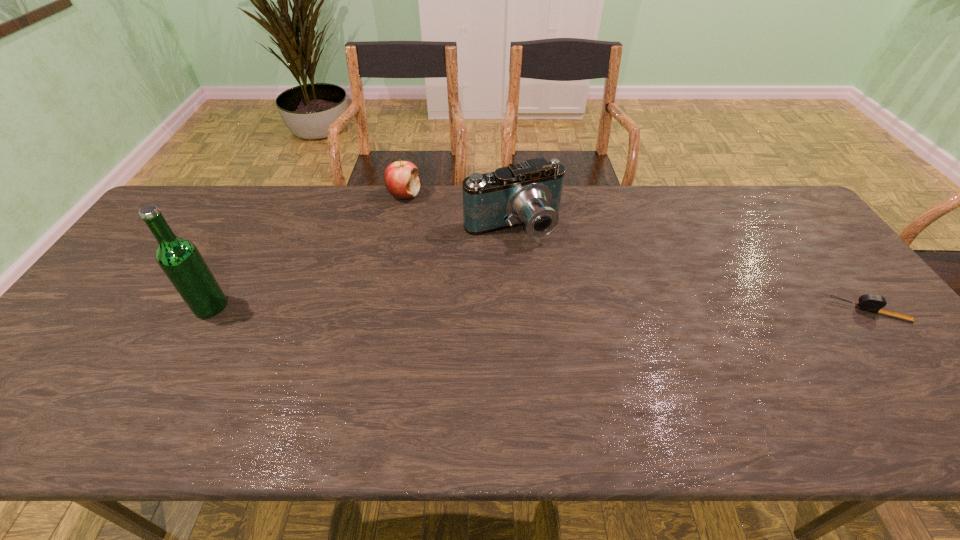
The width and height of the screenshot is (960, 540). Identify the location of empty space between the tallest object and the apple. (307, 251).

Where is `free point between the second tallest object and the leftmost object`? The width and height of the screenshot is (960, 540). free point between the second tallest object and the leftmost object is located at coordinates (362, 266).

You are a GUI agent. You are given a task and a screenshot of the screen. Output one action in this format:
    pyautogui.click(x=<x>, y=<y>)
    Task: Click on the vacant space that's between the apple and the shortest object
    This screenshot has width=960, height=540.
    Given the screenshot: What is the action you would take?
    point(636,253)

The image size is (960, 540). I want to click on free spot between the apple and the beer bottle, so click(x=307, y=251).

What are the coordinates of `object that is the third nearest to the camcorder` in the screenshot? It's located at (873, 303).

You are a GUI agent. You are given a task and a screenshot of the screen. Output one action in this format:
    pyautogui.click(x=<x>, y=<y>)
    Task: Click on the object that stands as the closest to the apple
    This screenshot has width=960, height=540.
    Given the screenshot: What is the action you would take?
    pyautogui.click(x=529, y=193)

Where is `vacant point that satisfies the following two spatial constraints: 1. on the front side of the leftmost object; 2. on the left side of the shortest object`? The image size is (960, 540). vacant point that satisfies the following two spatial constraints: 1. on the front side of the leftmost object; 2. on the left side of the shortest object is located at coordinates (208, 311).

Where is `vacant region that satisfies the following two spatial constraints: 1. on the back side of the second tallest object; 2. on the right side of the tallest object`? vacant region that satisfies the following two spatial constraints: 1. on the back side of the second tallest object; 2. on the right side of the tallest object is located at coordinates (255, 226).

This screenshot has width=960, height=540. Find the location of `vacant area in the image that satisfies the following two spatial constraints: 1. on the front side of the camcorder; 2. on the right side of the rightmost object`. vacant area in the image that satisfies the following two spatial constraints: 1. on the front side of the camcorder; 2. on the right side of the rightmost object is located at coordinates (519, 311).

Where is `vacant region that satisfies the following two spatial constraints: 1. on the front side of the camcorder; 2. on the left side of the tape measure`? The height and width of the screenshot is (540, 960). vacant region that satisfies the following two spatial constraints: 1. on the front side of the camcorder; 2. on the left side of the tape measure is located at coordinates (519, 311).